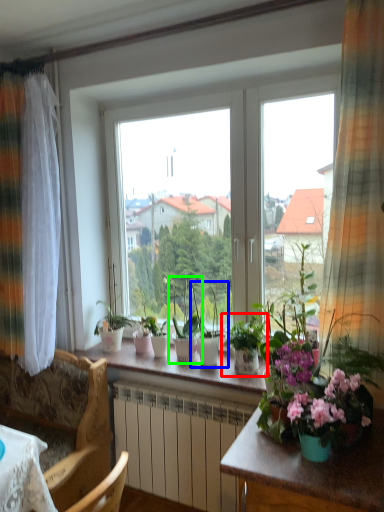
Question: Which object is the closest to the houseplant (highlighted by a red box)? Choose among these: houseplant (highlighted by a blue box) or houseplant (highlighted by a green box).

Choices:
 (A) houseplant
 (B) houseplant

Answer: (A)